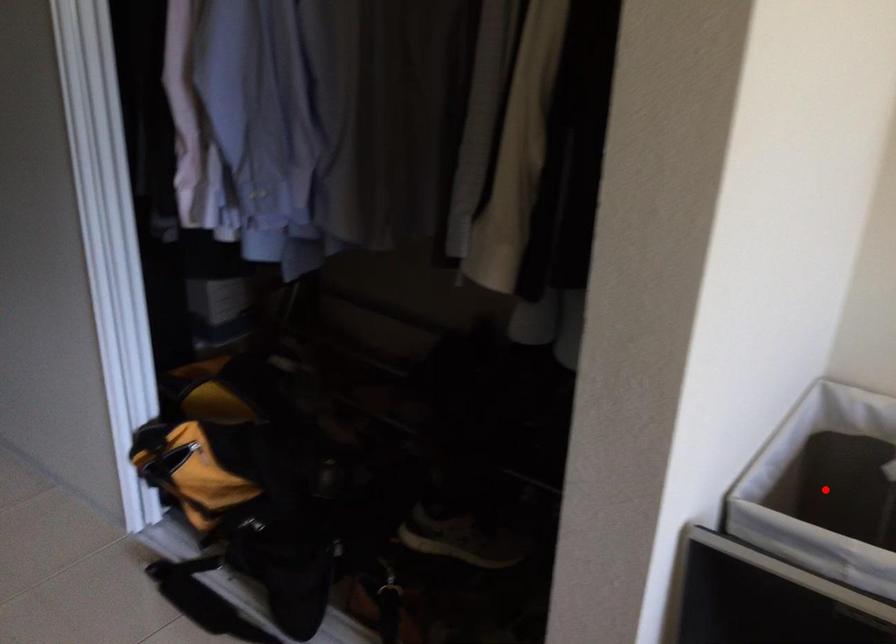
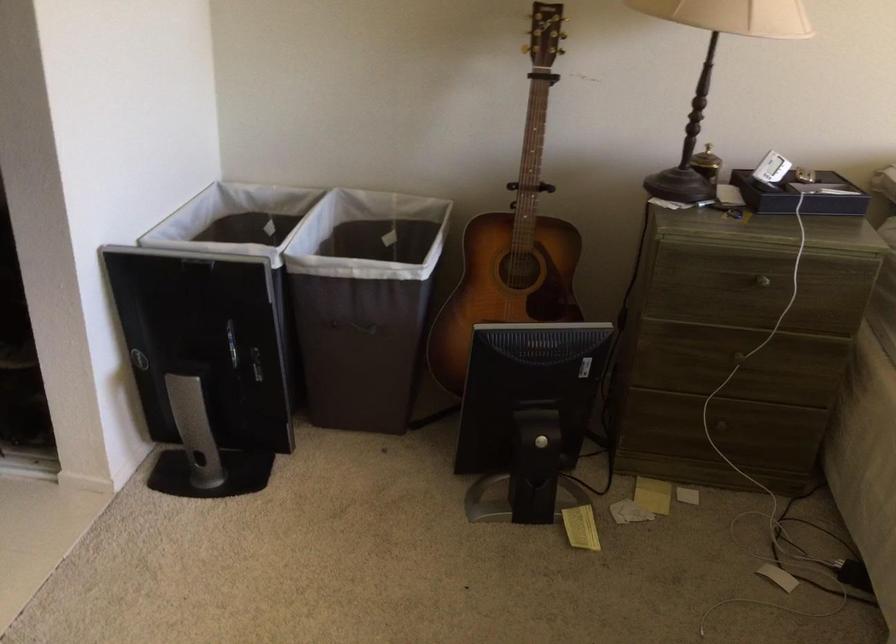
Question: I am providing you with two images of the same scene from different viewpoints. A red point is marked on the first image. Is the red point's position out of view in image 2?

Choices:
 (A) Yes
 (B) No

Answer: (A)